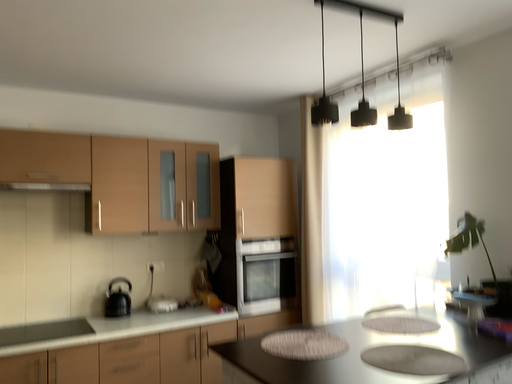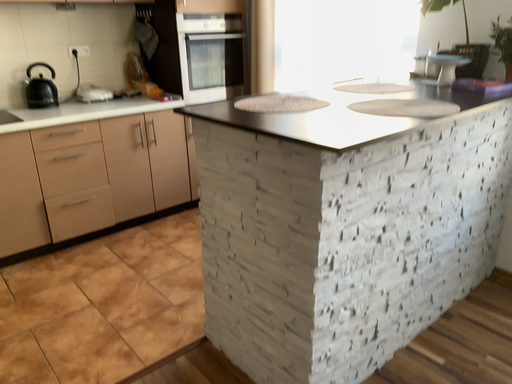
Question: How did the camera likely rotate when shooting the video?

Choices:
 (A) rotated left
 (B) rotated right

Answer: (B)